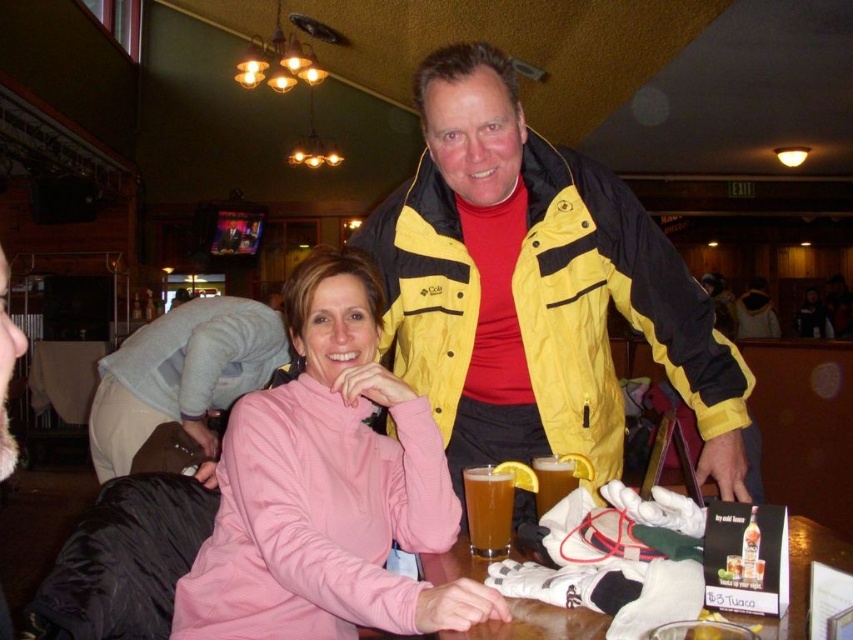
Question: Considering the real-world distances, which object is farthest from the gray fleece jacket at lower left?

Choices:
 (A) pink fleece at center
 (B) yellow/black jacket at center
 (C) wooden table at center

Answer: (C)

Question: Which of the following is the closest to the observer?

Choices:
 (A) (505, 422)
 (B) (563, 484)
 (C) (122, 464)

Answer: (B)

Question: Can you confirm if gray fleece jacket at lower left is positioned above translucent glass mug at center?

Choices:
 (A) yes
 (B) no

Answer: (A)

Question: Which object appears closest to the camera in this image?

Choices:
 (A) translucent glass at center
 (B) translucent glass mug at center
 (C) gray fleece jacket at lower left
 (D) pink fleece at center

Answer: (D)

Question: In this image, where is pink fleece at center located relative to wooden table at center?

Choices:
 (A) below
 (B) above

Answer: (B)

Question: Is yellow/black jacket at center behind gray fleece jacket at lower left?

Choices:
 (A) yes
 (B) no

Answer: (B)